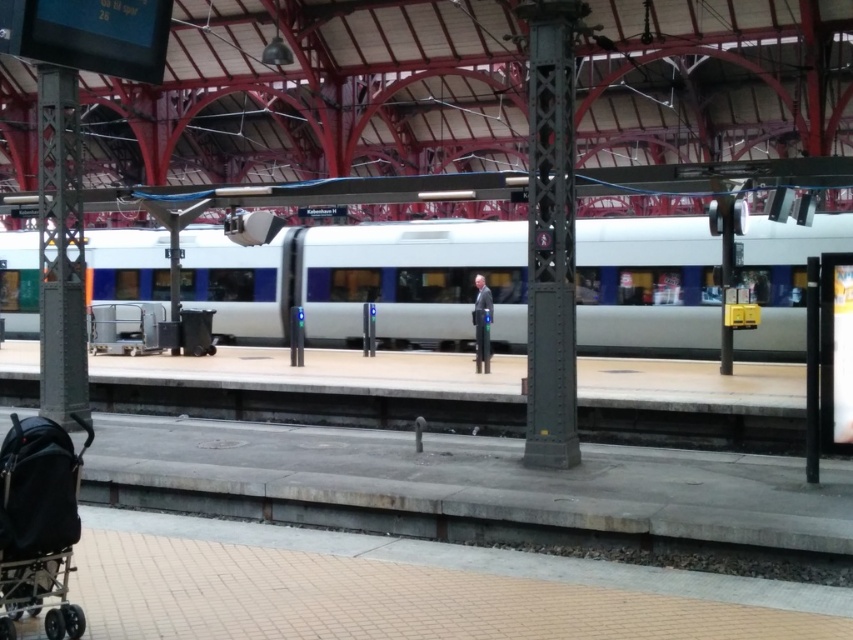
Question: Does silver metallic train at center appear under light blue fabric jacket at center?

Choices:
 (A) yes
 (B) no

Answer: (B)

Question: Does black fabric baby carriage at lower left come behind light blue fabric jacket at center?

Choices:
 (A) no
 (B) yes

Answer: (A)

Question: Among these objects, which one is nearest to the camera?

Choices:
 (A) light blue fabric jacket at center
 (B) black fabric baby carriage at lower left
 (C) silver metallic train at center

Answer: (B)

Question: Does silver metallic train at center have a smaller size compared to black fabric baby carriage at lower left?

Choices:
 (A) no
 (B) yes

Answer: (A)

Question: Which point appears farthest from the camera in this image?

Choices:
 (A) (74, 464)
 (B) (815, 234)

Answer: (B)

Question: Which of the following is the farthest from the observer?

Choices:
 (A) (343, 289)
 (B) (482, 348)
 (C) (33, 458)

Answer: (A)